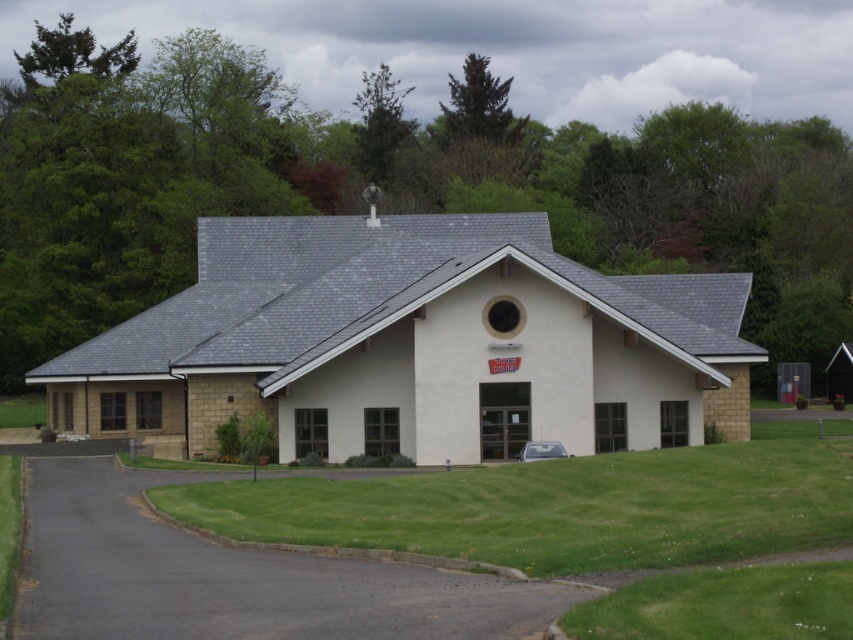
You are planning to install a new garden path leading from the black asphalt driveway at lower left to the green grass at center. Which area has more space to accommodate the path?

The green grass at center has a larger width than the black asphalt driveway at lower left, so it can accommodate the path more easily.

You are a photographer planning to capture the white smooth chapel at center and the black asphalt driveway at lower left in a single shot. Based on their relative heights, which object should you position closer to the camera to emphasize its dominance in the composition?

The white smooth chapel at center has a greater height compared to the black asphalt driveway at lower left, so positioning the chapel closer to the camera will emphasize its dominance in the composition.